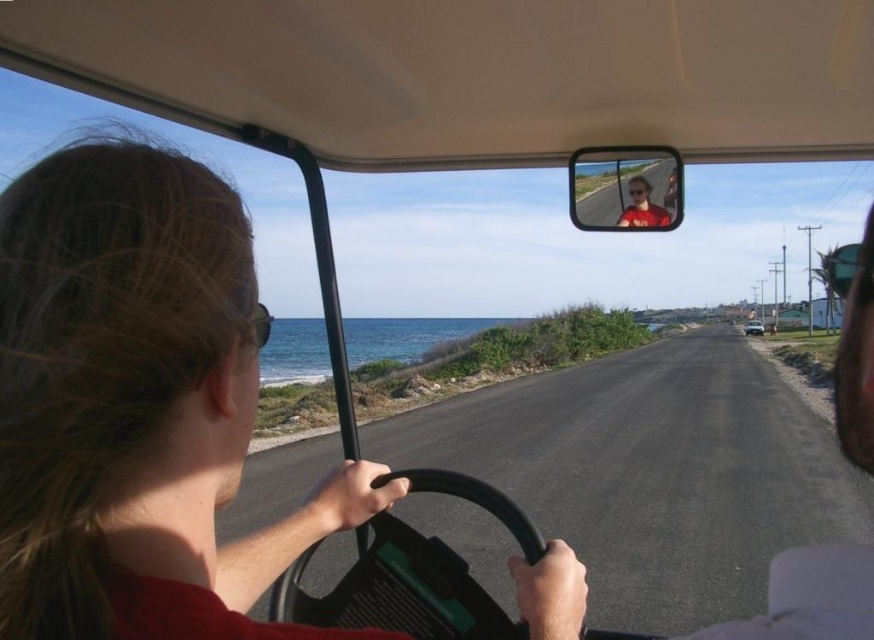
Is matte red shirt at center to the right of matte black rearview mirror at upper center from the viewer's perspective?

Correct, you'll find matte red shirt at center to the right of matte black rearview mirror at upper center.

Image resolution: width=874 pixels, height=640 pixels. Describe the element at coordinates (810, 596) in the screenshot. I see `matte red shirt at center` at that location.

Between point (866, 257) and point (669, 212), which one is positioned in front?

Point (866, 257) is more forward.

Locate an element on the screen. matte red shirt at center is located at coordinates (810, 596).

Image resolution: width=874 pixels, height=640 pixels. What do you see at coordinates (625, 188) in the screenshot?
I see `matte black rearview mirror at upper center` at bounding box center [625, 188].

Between matte black rearview mirror at upper center and metallic silver sedan at center, which one appears on the left side from the viewer's perspective?

matte black rearview mirror at upper center is more to the left.

Is point (637, 152) less distant than point (753, 326)?

Yes, it is.

The height and width of the screenshot is (640, 874). Find the location of `matte black rearview mirror at upper center`. matte black rearview mirror at upper center is located at coordinates (625, 188).

Between matte red shirt at center and metallic silver sedan at center, which one is positioned lower?

matte red shirt at center is below.

Is point (850, 260) positioned after point (747, 332)?

No, (850, 260) is closer to viewer.

Which is in front, point (822, 593) or point (753, 333)?

Point (822, 593) is in front.

Image resolution: width=874 pixels, height=640 pixels. I want to click on matte red shirt at center, so click(x=810, y=596).